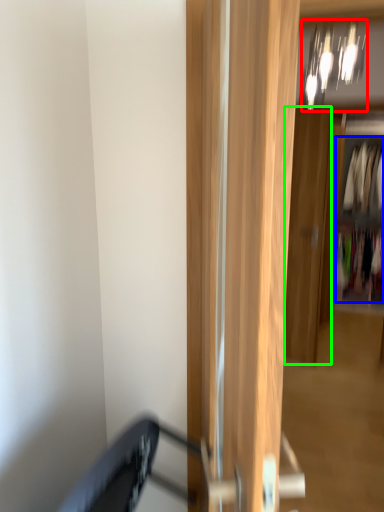
Question: Considering the real-world distances, which object is closest to light fixture (highlighted by a red box)? clothing (highlighted by a blue box) or door (highlighted by a green box).

Choices:
 (A) clothing
 (B) door

Answer: (B)